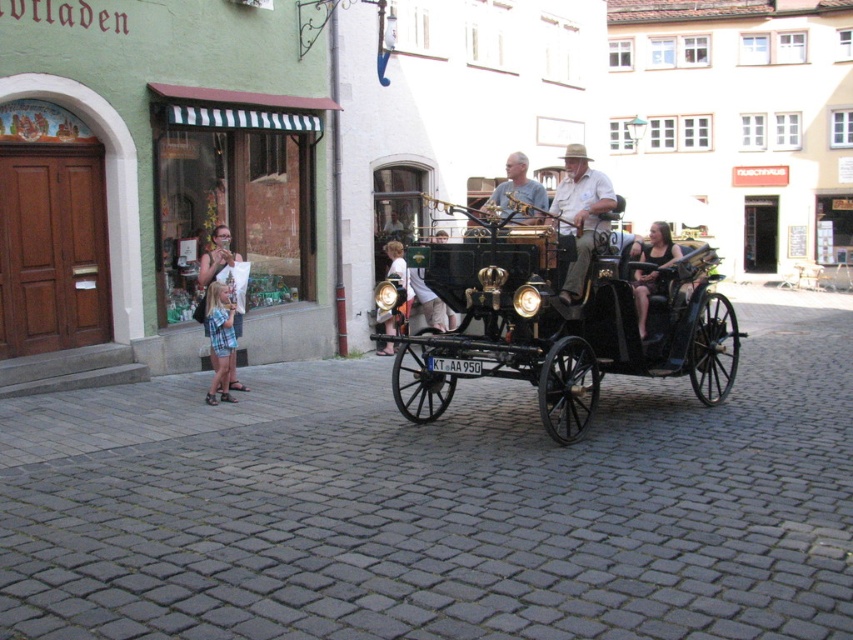
How distant is polished wood horse cart at center from dark brown leather jacket at center?

They are 3.72 meters apart.

Between polished wood horse cart at center and dark brown leather jacket at center, which one is positioned lower?

polished wood horse cart at center

Find the location of a particular element. Image resolution: width=853 pixels, height=640 pixels. polished wood horse cart at center is located at coordinates (563, 324).

Which is more to the right, light beige fabric hat at center or dark brown leather jacket at center?

dark brown leather jacket at center

Can you confirm if light beige fabric hat at center is wider than dark brown leather jacket at center?

In fact, light beige fabric hat at center might be narrower than dark brown leather jacket at center.

Between point (579, 195) and point (668, 241), which one is positioned in front?

Positioned in front is point (579, 195).

Locate an element on the screen. Image resolution: width=853 pixels, height=640 pixels. light beige fabric hat at center is located at coordinates (579, 212).

Is polished wood horse cart at center to the right of light beige fabric hat at center from the viewer's perspective?

Indeed, polished wood horse cart at center is positioned on the right side of light beige fabric hat at center.

Who is shorter, polished wood horse cart at center or light beige fabric hat at center?

With less height is light beige fabric hat at center.

Does point (550, 353) come behind point (561, 179)?

No, (550, 353) is closer to viewer.

Identify the location of polished wood horse cart at center. (563, 324).